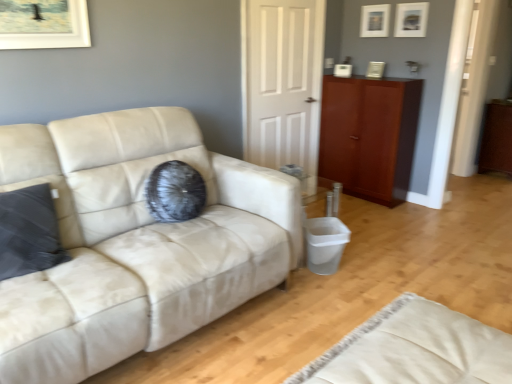
Question: From a real-world perspective, is beige fabric rug at lower right physically located above or below brown wood dresser at right?

Choices:
 (A) below
 (B) above

Answer: (A)

Question: Visually, is beige fabric rug at lower right positioned to the left or to the right of brown wood dresser at right?

Choices:
 (A) left
 (B) right

Answer: (A)

Question: Which object is positioned farthest from the suede off-white couch at left?

Choices:
 (A) white matte door at center
 (B) matte white picture frame at upper right, arranged as the second picture frame when viewed from the right
 (C) mahogany wood cabinet at right
 (D) matte white picture frame at upper center, placed as the second picture frame when sorted from left to right
 (E) beige fabric rug at lower right

Answer: (B)

Question: Based on their relative distances, which object is farther from the suede off-white couch at left?

Choices:
 (A) brown wood dresser at right
 (B) matte white picture frame at upper right, the 1th picture frame viewed from the left
 (C) white matte door at center
 (D) mahogany wood cabinet at right
 (E) matte white picture frame at upper center, arranged as the 1th picture frame when viewed from the right

Answer: (A)